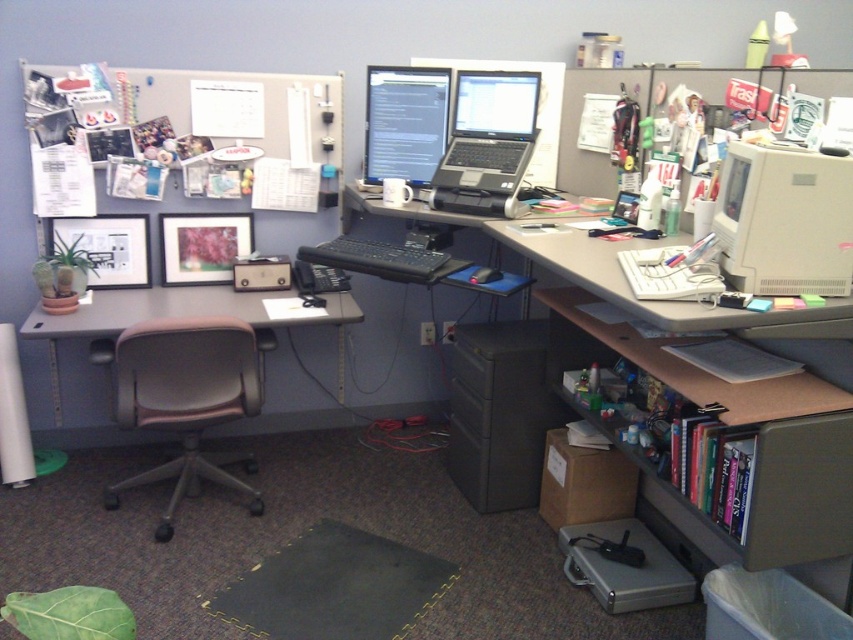
Question: Can you confirm if white plastic computer desk at center is positioned to the left of brown leather desk at center?

Choices:
 (A) yes
 (B) no

Answer: (B)

Question: Which object is the farthest from the matte black monitor at center?

Choices:
 (A) black plastic laptop at center
 (B) white plastic monitor at upper right
 (C) white plastic computer desk at center
 (D) gray fabric swivel chair at lower left

Answer: (B)

Question: Considering the relative positions of white plastic computer desk at center and brown leather desk at center in the image provided, where is white plastic computer desk at center located with respect to brown leather desk at center?

Choices:
 (A) left
 (B) right

Answer: (B)

Question: Which object appears closest to the camera in this image?

Choices:
 (A) matte black monitor at center
 (B) white plastic monitor at upper right

Answer: (B)

Question: In this image, where is white plastic computer desk at center located relative to white plastic monitor at upper right?

Choices:
 (A) above
 (B) below

Answer: (B)

Question: Which point is farther to the camera?

Choices:
 (A) (822, 538)
 (B) (408, 141)
 (C) (334, 378)
 (D) (143, 328)

Answer: (C)